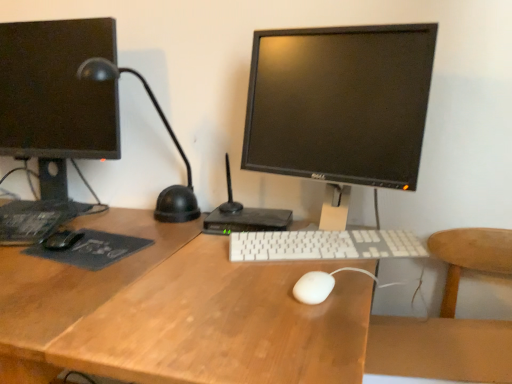
Find the location of a particular element. The width and height of the screenshot is (512, 384). free space that is in between white plastic keyboard at center and white matte mouse at center, the second mouse viewed from the left is located at coordinates (306, 269).